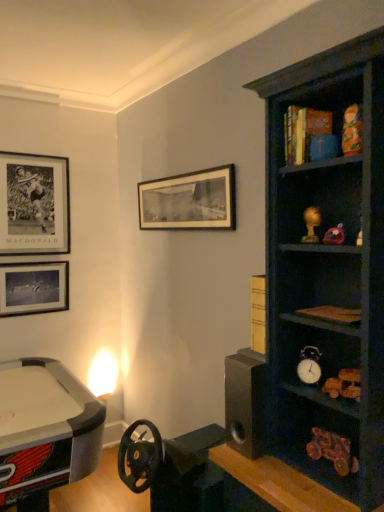
What do you see at coordinates (352, 131) in the screenshot? This screenshot has height=512, width=384. I see `multicolored wooden doll at upper right, which is the first toy in front-to-back order` at bounding box center [352, 131].

The image size is (384, 512). Find the location of `metallic silver alarm clock at center-right`. metallic silver alarm clock at center-right is located at coordinates (309, 365).

What do you see at coordinates (33, 288) in the screenshot?
I see `matte black picture frame at upper left, which is the third picture frame from right to left` at bounding box center [33, 288].

The height and width of the screenshot is (512, 384). Describe the element at coordinates (34, 204) in the screenshot. I see `black matte picture frame at upper left, the 2th picture frame from the right` at that location.

Find the location of a particular element. The height and width of the screenshot is (512, 384). matte gold figurine at upper right, the 2th toy from the top is located at coordinates (311, 224).

Measure the distance between point (211,177) and camera.

A distance of 7.48 feet exists between point (211,177) and camera.

Locate an element on the screen. The width and height of the screenshot is (384, 512). multicolored wooden doll at upper right, acting as the 2th toy starting from the bottom is located at coordinates (352, 131).

Can you confirm if multicolored wooden doll at upper right, which is the first toy in front-to-back order, is taller than black matte picture frame at upper left, the 2th picture frame from the right?

No, multicolored wooden doll at upper right, which is the first toy in front-to-back order, is not taller than black matte picture frame at upper left, the 2th picture frame from the right.

The image size is (384, 512). Identify the location of toy that is the 2nd one when counting rightward from the black matte picture frame at upper left, the second picture frame in the left-to-right sequence. (x=352, y=131).

Looking at the image, does multicolored wooden doll at upper right, which is the first toy in front-to-back order, seem bigger or smaller compared to black matte picture frame at upper left, the second picture frame in the left-to-right sequence?

Clearly, multicolored wooden doll at upper right, which is the first toy in front-to-back order, is smaller in size than black matte picture frame at upper left, the second picture frame in the left-to-right sequence.

Is multicolored wooden doll at upper right, positioned as the 2th toy in back-to-front order, positioned far away from black matte picture frame at upper left, the 2th picture frame from the right?

Yes.

Does matte gold figurine at upper right, acting as the 1th toy starting from the back, have a greater height compared to matte black picture frame at upper left, which is the first picture frame from left to right?

No.

Which of these two, matte gold figurine at upper right, the 2th toy from the top, or matte black picture frame at upper left, which is the third picture frame from right to left, is thinner?

With smaller width is matte black picture frame at upper left, which is the third picture frame from right to left.

Is matte black picture frame at upper left, which is the first picture frame from left to right, inside matte gold figurine at upper right, the second toy viewed from the front?

Actually, matte black picture frame at upper left, which is the first picture frame from left to right, is outside matte gold figurine at upper right, the second toy viewed from the front.

Considering the positions of objects black matte picture frame at upper center, positioned as the third picture frame in left-to-right order, and metallic silver alarm clock at center-right in the image provided, who is more to the left, black matte picture frame at upper center, positioned as the third picture frame in left-to-right order, or metallic silver alarm clock at center-right?

black matte picture frame at upper center, positioned as the third picture frame in left-to-right order.

Which of these two, black matte picture frame at upper center, positioned as the third picture frame in left-to-right order, or metallic silver alarm clock at center-right, stands taller?

black matte picture frame at upper center, positioned as the third picture frame in left-to-right order.

Which point is more distant from viewer, (210, 216) or (315, 377)?

The point (210, 216) is more distant.

Is point (148, 223) closer or farther from the camera than point (353, 133)?

Clearly, point (148, 223) is more distant from the camera than point (353, 133).

From the image's perspective, who appears lower, black matte picture frame at upper center, positioned as the third picture frame in left-to-right order, or multicolored wooden doll at upper right, placed as the 1th toy when sorted from top to bottom?

black matte picture frame at upper center, positioned as the third picture frame in left-to-right order, is shown below in the image.

Would you consider black matte picture frame at upper center, which ranks as the first picture frame in right-to-left order, to be distant from multicolored wooden doll at upper right, placed as the 1th toy when sorted from top to bottom?

Yes.

Considering the relative positions of black matte picture frame at upper center, positioned as the third picture frame in left-to-right order, and multicolored wooden doll at upper right, which is the first toy in front-to-back order, in the image provided, is black matte picture frame at upper center, positioned as the third picture frame in left-to-right order, behind multicolored wooden doll at upper right, which is the first toy in front-to-back order,?

Yes, the depth of black matte picture frame at upper center, positioned as the third picture frame in left-to-right order, is greater than that of multicolored wooden doll at upper right, which is the first toy in front-to-back order.

Is black matte picture frame at upper left, the 2th picture frame from the right, behind black matte picture frame at upper center, which ranks as the first picture frame in right-to-left order?

Yes, black matte picture frame at upper left, the 2th picture frame from the right, is further from the camera.

How different are the orientations of black matte picture frame at upper left, the 2th picture frame from the right, and black matte picture frame at upper center, which ranks as the first picture frame in right-to-left order, in degrees?

They differ by 89.6 degrees in their facing directions.

Which picture frame is the 1st one when counting from the left side of the black matte picture frame at upper center, which ranks as the first picture frame in right-to-left order? Please provide its 2D coordinates.

[(34, 204)]

In the scene shown: Can you confirm if metallic silver alarm clock at center-right is taller than matte gold figurine at upper right, acting as the 1th toy starting from the back?

Yes, metallic silver alarm clock at center-right is taller than matte gold figurine at upper right, acting as the 1th toy starting from the back.

Would you say metallic silver alarm clock at center-right is a long distance from matte gold figurine at upper right, placed as the 1th toy when sorted from bottom to top?

No, metallic silver alarm clock at center-right is not far from matte gold figurine at upper right, placed as the 1th toy when sorted from bottom to top.

Who is bigger, metallic silver alarm clock at center-right or matte gold figurine at upper right, the 2th toy from the top?

metallic silver alarm clock at center-right is bigger.

Can you confirm if metallic silver alarm clock at center-right is thinner than matte gold figurine at upper right, acting as the 1th toy starting from the back?

No, metallic silver alarm clock at center-right is not thinner than matte gold figurine at upper right, acting as the 1th toy starting from the back.

Which of these two, black matte picture frame at upper center, which ranks as the first picture frame in right-to-left order, or matte gold figurine at upper right, the 2th toy from the top, stands shorter?

matte gold figurine at upper right, the 2th toy from the top, is shorter.

From a real-world perspective, who is located lower, black matte picture frame at upper center, which ranks as the first picture frame in right-to-left order, or matte gold figurine at upper right, placed as the 1th toy when sorted from bottom to top?

matte gold figurine at upper right, placed as the 1th toy when sorted from bottom to top, is physically lower.

The width and height of the screenshot is (384, 512). In order to click on the 1st toy in front when counting from the black matte picture frame at upper center, positioned as the third picture frame in left-to-right order in this screenshot , I will do `click(311, 224)`.

Which is behind, black matte picture frame at upper center, which ranks as the first picture frame in right-to-left order, or matte gold figurine at upper right, placed as the 1th toy when sorted from bottom to top?

black matte picture frame at upper center, which ranks as the first picture frame in right-to-left order.

From the image's perspective, starting from the multicolored wooden doll at upper right, which is the first toy in front-to-back order, which picture frame is the 1st one below? Please provide its 2D coordinates.

[(34, 204)]

This screenshot has height=512, width=384. I want to click on the 3rd picture frame behind when counting from the matte gold figurine at upper right, the 2th toy from the top, so click(33, 288).

Looking at this image, when comparing their distances from black matte picture frame at upper left, the 2th picture frame from the right, does metallic silver alarm clock at center-right or multicolored wooden doll at upper right, positioned as the 2th toy in back-to-front order, seem closer?

metallic silver alarm clock at center-right is closer to black matte picture frame at upper left, the 2th picture frame from the right.

Based on their spatial positions, is black matte picture frame at upper left, the 2th picture frame from the right, or matte gold figurine at upper right, placed as the 1th toy when sorted from bottom to top, further from metallic silver alarm clock at center-right?

black matte picture frame at upper left, the 2th picture frame from the right, lies further to metallic silver alarm clock at center-right than the other object.

In the scene shown: Estimate the real-world distances between objects in this image. Which object is further from matte gold figurine at upper right, the 2th toy from the top, multicolored wooden doll at upper right, which is the first toy in front-to-back order, or matte black picture frame at upper left, which is the first picture frame from left to right?

matte black picture frame at upper left, which is the first picture frame from left to right.

In the scene shown: From the image, which object appears to be nearer to matte gold figurine at upper right, acting as the 1th toy starting from the back, metallic silver alarm clock at center-right or black matte picture frame at upper left, the 2th picture frame from the right?

metallic silver alarm clock at center-right lies closer to matte gold figurine at upper right, acting as the 1th toy starting from the back, than the other object.

Estimate the real-world distances between objects in this image. Which object is closer to matte gold figurine at upper right, the 2th toy from the top, matte black picture frame at upper left, which is the third picture frame from right to left, or multicolored wooden doll at upper right, acting as the 2th toy starting from the bottom?

multicolored wooden doll at upper right, acting as the 2th toy starting from the bottom.

From the image, which object appears to be nearer to black matte picture frame at upper center, positioned as the third picture frame in left-to-right order, matte black picture frame at upper left, which is the third picture frame from right to left, or black matte picture frame at upper left, the 2th picture frame from the right?

The object closer to black matte picture frame at upper center, positioned as the third picture frame in left-to-right order, is black matte picture frame at upper left, the 2th picture frame from the right.

Estimate the real-world distances between objects in this image. Which object is further from black matte picture frame at upper left, the second picture frame in the left-to-right sequence, matte black picture frame at upper left, which is the first picture frame from left to right, or black matte picture frame at upper center, positioned as the third picture frame in left-to-right order?

black matte picture frame at upper center, positioned as the third picture frame in left-to-right order, is further to black matte picture frame at upper left, the second picture frame in the left-to-right sequence.

Considering their positions, is matte black picture frame at upper left, which is the first picture frame from left to right, positioned closer to matte gold figurine at upper right, the 2th toy from the top, than black matte picture frame at upper center, which ranks as the first picture frame in right-to-left order?

black matte picture frame at upper center, which ranks as the first picture frame in right-to-left order, is positioned closer to the anchor matte gold figurine at upper right, the 2th toy from the top.

Image resolution: width=384 pixels, height=512 pixels. Find the location of `toy between black matte picture frame at upper center, positioned as the third picture frame in left-to-right order, and metallic silver alarm clock at center-right from top to bottom`. toy between black matte picture frame at upper center, positioned as the third picture frame in left-to-right order, and metallic silver alarm clock at center-right from top to bottom is located at coordinates (311, 224).

The width and height of the screenshot is (384, 512). I want to click on clock between black matte picture frame at upper left, the 2th picture frame from the right, and matte gold figurine at upper right, acting as the 1th toy starting from the back, so click(309, 365).

The width and height of the screenshot is (384, 512). In order to click on toy between matte black picture frame at upper left, which is the first picture frame from left to right, and multicolored wooden doll at upper right, positioned as the 2th toy in back-to-front order, in the horizontal direction in this screenshot , I will do `click(311, 224)`.

Where is `toy between black matte picture frame at upper left, the 2th picture frame from the right, and multicolored wooden doll at upper right, positioned as the 2th toy in back-to-front order, from left to right`? Image resolution: width=384 pixels, height=512 pixels. toy between black matte picture frame at upper left, the 2th picture frame from the right, and multicolored wooden doll at upper right, positioned as the 2th toy in back-to-front order, from left to right is located at coordinates click(311, 224).